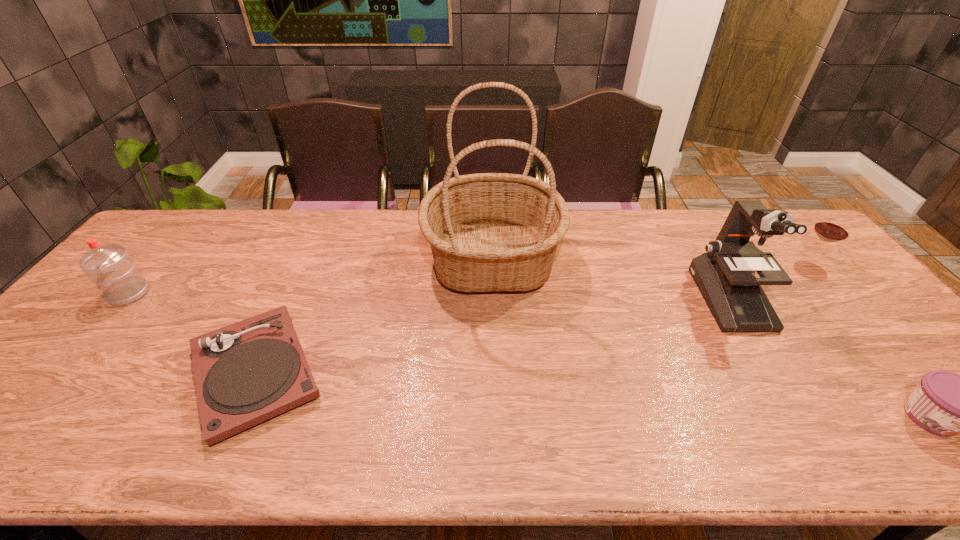
This screenshot has width=960, height=540. I want to click on vacant region at the right edge of the desktop, so click(876, 382).

Where is `empty location between the fifth shortest object and the fourth object from right to left`? The height and width of the screenshot is (540, 960). empty location between the fifth shortest object and the fourth object from right to left is located at coordinates (612, 279).

Image resolution: width=960 pixels, height=540 pixels. I want to click on free spot between the basket and the microscope, so click(x=612, y=279).

Where is `vacant area that lies between the shortest object and the wineglass`? vacant area that lies between the shortest object and the wineglass is located at coordinates (533, 318).

Locate an element on the screen. Image resolution: width=960 pixels, height=540 pixels. vacant space that's between the water bottle and the fourth object from left to right is located at coordinates (429, 296).

You are a GUI agent. You are given a task and a screenshot of the screen. Output one action in this format:
    pyautogui.click(x=<x>, y=<y>)
    Task: Click on the vacant space in between the basket and the leftmost object
    Image resolution: width=960 pixels, height=540 pixels.
    Given the screenshot: What is the action you would take?
    pyautogui.click(x=311, y=276)

Locate which object is the closest to the fourth object from right to left. Please provide its 2D coordinates. Your answer should be formatted as a tuple, i.e. [(x, y)], where the tuple contains the x and y coordinates of a point satisfying the conditions above.

[(250, 371)]

Locate an element on the screen. object that stands as the closest to the basket is located at coordinates (x=250, y=371).

Locate an element on the screen. The height and width of the screenshot is (540, 960). vacant space that satisfies the following two spatial constraints: 1. on the handle side of the third tallest object; 2. on the right side of the phonograph_record is located at coordinates pyautogui.click(x=61, y=373).

Where is `free region that satisfies the following two spatial constraints: 1. on the front side of the wineglass; 2. on the handle side of the third tallest object`? The width and height of the screenshot is (960, 540). free region that satisfies the following two spatial constraints: 1. on the front side of the wineglass; 2. on the handle side of the third tallest object is located at coordinates (838, 294).